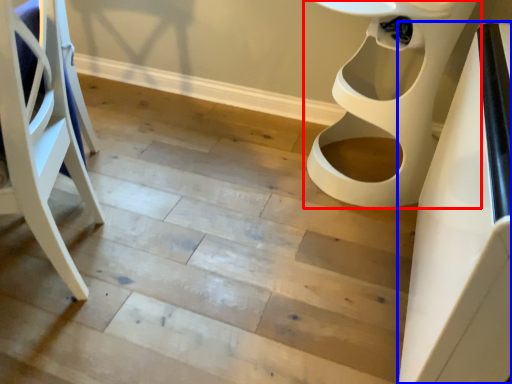
Question: Which object is further to the camera taking this photo, toilet (highlighted by a red box) or table (highlighted by a blue box)?

Choices:
 (A) toilet
 (B) table

Answer: (A)